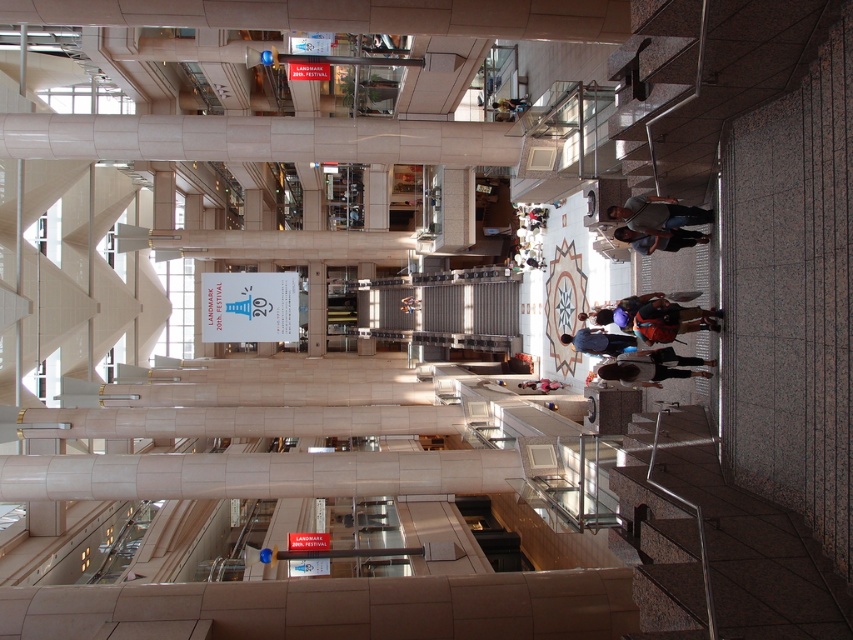
Between orange fabric backpack at center and orange fabric bag at center, which one is positioned higher?

orange fabric bag at center is above.

Does orange fabric backpack at center have a lesser width compared to orange fabric bag at center?

In fact, orange fabric backpack at center might be wider than orange fabric bag at center.

Which is in front, point (643, 316) or point (416, 308)?

Point (643, 316)

The height and width of the screenshot is (640, 853). What are the coordinates of `orange fabric backpack at center` in the screenshot? It's located at (671, 321).

How far apart are dark gray shirt at right and orange fabric bag at center?

dark gray shirt at right and orange fabric bag at center are 42.46 meters apart from each other.

What do you see at coordinates (657, 212) in the screenshot? I see `dark gray shirt at right` at bounding box center [657, 212].

You are a GUI agent. You are given a task and a screenshot of the screen. Output one action in this format:
    pyautogui.click(x=<x>, y=<y>)
    Task: Click on the dark gray shirt at right
    Image resolution: width=853 pixels, height=640 pixels.
    Given the screenshot: What is the action you would take?
    657,212

Between dark gray shirt at right and matte black backpack at center, which one is positioned lower?

matte black backpack at center is lower down.

Can you confirm if dark gray shirt at right is smaller than matte black backpack at center?

Correct, dark gray shirt at right occupies less space than matte black backpack at center.

Does point (662, 209) come farther from viewer compared to point (544, 387)?

That is False.

Identify the location of dark gray shirt at right. The height and width of the screenshot is (640, 853). (657, 212).